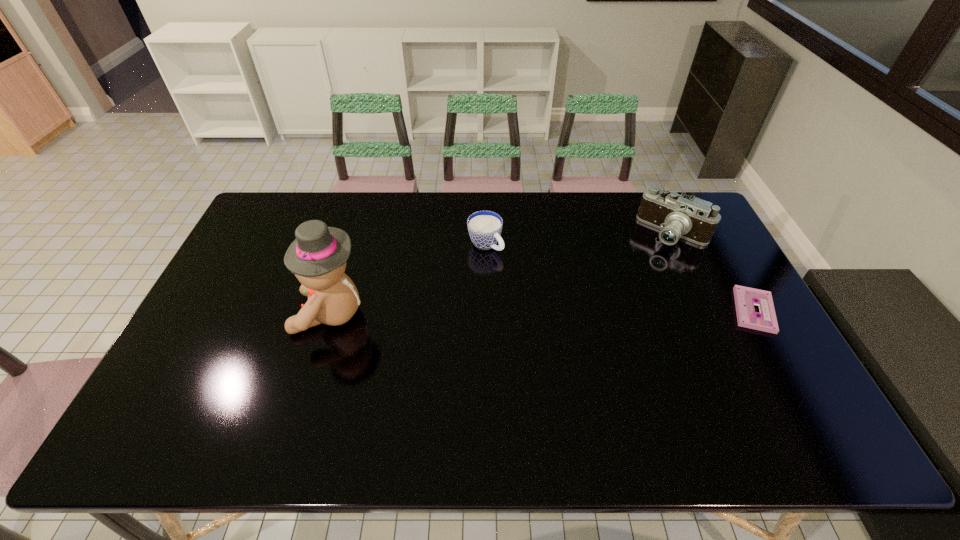
I want to click on free space on the desktop that is between the tallest object and the shortest object and is positioned on the side of the cup with the handle, so click(570, 312).

The image size is (960, 540). I want to click on free space on the desktop that is between the leftmost object and the shortest object and is positioned at the lens of the camera, so click(x=588, y=311).